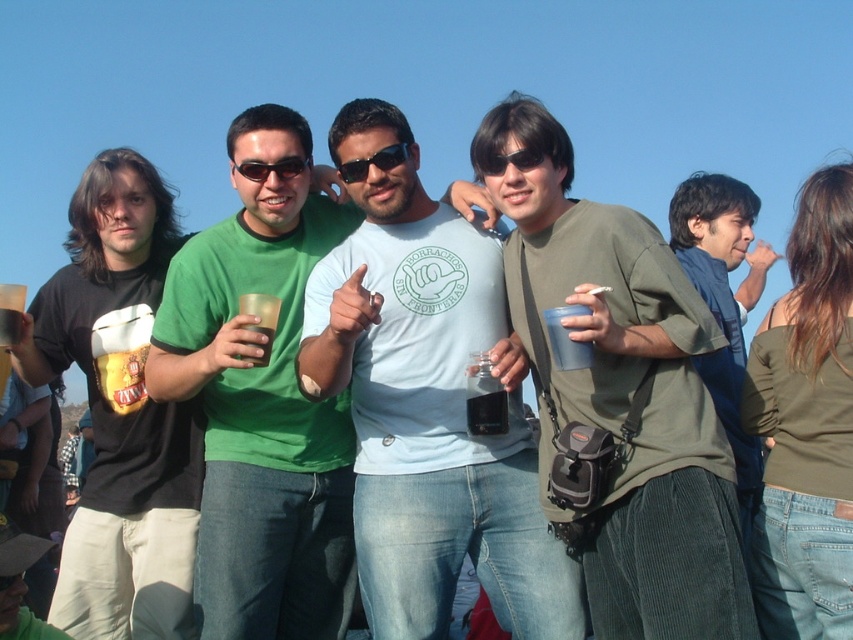
Looking at this image, does blue corduroy pants at center have a larger size compared to translucent plastic cup at center?

Indeed, blue corduroy pants at center has a larger size compared to translucent plastic cup at center.

Is point (706, 192) in front of point (561, 340)?

No, (706, 192) is further to viewer.

At what (x,y) coordinates should I click in order to perform the action: click on blue corduroy pants at center. Please return your answer as a coordinate pair (x, y). Image resolution: width=853 pixels, height=640 pixels. Looking at the image, I should click on (720, 305).

Image resolution: width=853 pixels, height=640 pixels. I want to click on blue corduroy pants at center, so click(720, 305).

Is point (402, 148) more distant than point (524, 148)?

Yes, it is behind point (524, 148).

Consider the image. Is black plastic sunglasses at center above sunglasses at center?

Yes, black plastic sunglasses at center is above sunglasses at center.

You are a GUI agent. You are given a task and a screenshot of the screen. Output one action in this format:
    pyautogui.click(x=<x>, y=<y>)
    Task: Click on the black plastic sunglasses at center
    This screenshot has width=853, height=640.
    Given the screenshot: What is the action you would take?
    pyautogui.click(x=373, y=163)

Can you confirm if brown matte cup at center is positioned above sunglasses at center?

No, brown matte cup at center is not above sunglasses at center.

Locate an element on the screen. The height and width of the screenshot is (640, 853). brown matte cup at center is located at coordinates (260, 321).